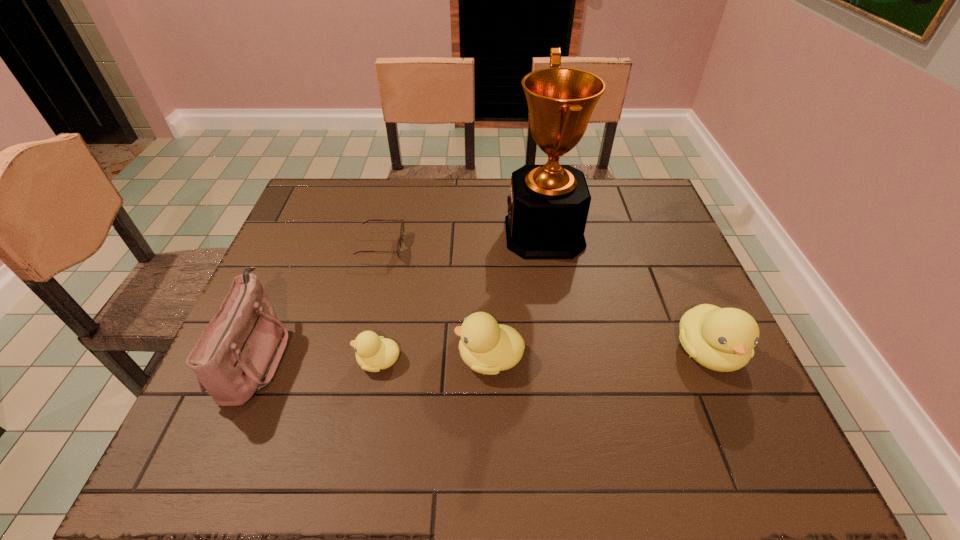
Find the location of `vacant space at the far left corner of the desktop`. vacant space at the far left corner of the desktop is located at coordinates (326, 179).

At what (x,y) coordinates should I click in order to perform the action: click on free space at the near left corner. Please return your answer as a coordinate pair (x, y). Looking at the image, I should click on (226, 415).

Where is `free space at the near right corner`? This screenshot has width=960, height=540. free space at the near right corner is located at coordinates (677, 384).

Identify the location of vacant point located between the trophy cup and the rightmost duckling. The width and height of the screenshot is (960, 540). (626, 293).

At what (x,y) coordinates should I click in order to perform the action: click on blank region between the second tallest duckling and the rightmost object. Please return your answer as a coordinate pair (x, y). Image resolution: width=960 pixels, height=540 pixels. Looking at the image, I should click on (599, 355).

Find the location of a particular element. Image resolution: width=960 pixels, height=540 pixels. free space that is in between the spectacles and the rightmost object is located at coordinates (544, 299).

Find the location of a particular element. The width and height of the screenshot is (960, 540). vacant area between the second shortest duckling and the shortest object is located at coordinates (436, 302).

This screenshot has width=960, height=540. Identify the location of free space that is in between the shoulder bag and the fifth tallest object. pos(317,359).

This screenshot has height=540, width=960. Identify the location of free space between the rightmost object and the fourth tallest object. (599, 355).

You are a GUI agent. You are given a task and a screenshot of the screen. Output one action in this format:
    pyautogui.click(x=<x>, y=<y>)
    Task: Click on the vacant space in between the second shortest object and the tallest object
    
    Given the screenshot: What is the action you would take?
    pyautogui.click(x=461, y=298)